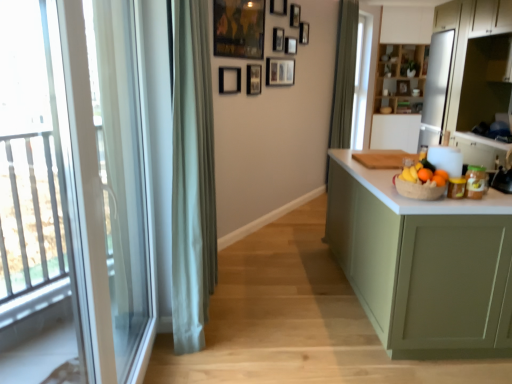
Question: Is wooden picture frame at upper center, which ranks as the 9th picture frame in left-to-right order, taller than orange matte at right, which appears as the 3th orange when viewed from the right?

Choices:
 (A) yes
 (B) no

Answer: (A)

Question: Does wooden picture frame at upper center, the second picture frame from the back, appear on the left side of orange matte at right, which appears as the 3th orange when viewed from the right?

Choices:
 (A) yes
 (B) no

Answer: (A)

Question: Does wooden picture frame at upper center, the second picture frame from the back, appear on the right side of orange matte at right, arranged as the first orange when viewed from the left?

Choices:
 (A) yes
 (B) no

Answer: (B)

Question: Is wooden picture frame at upper center, which ranks as the 9th picture frame in left-to-right order, in front of orange matte at right, arranged as the first orange when viewed from the left?

Choices:
 (A) no
 (B) yes

Answer: (A)

Question: Is wooden picture frame at upper center, the 9th picture frame in the front-to-back sequence, smaller than orange matte at right, arranged as the first orange when viewed from the left?

Choices:
 (A) no
 (B) yes

Answer: (A)

Question: Does wooden picture frame at upper center, the 9th picture frame in the front-to-back sequence, have a lesser width compared to orange matte at right, which appears as the 3th orange when viewed from the right?

Choices:
 (A) yes
 (B) no

Answer: (A)

Question: Is white matte cabinet at upper right, acting as the second cabinetry starting from the front, shorter than matte black picture frame at upper center, the 5th picture frame when ordered from right to left?

Choices:
 (A) no
 (B) yes

Answer: (A)

Question: Are white matte cabinet at upper right, which ranks as the 3th cabinetry in back-to-front order, and matte black picture frame at upper center, the 5th picture frame positioned from the front, located far from each other?

Choices:
 (A) no
 (B) yes

Answer: (B)

Question: Does white matte cabinet at upper right, acting as the second cabinetry starting from the front, appear on the right side of matte black picture frame at upper center, which appears as the 6th picture frame when viewed from the left?

Choices:
 (A) yes
 (B) no

Answer: (A)

Question: Can you see white matte cabinet at upper right, which ranks as the 3th cabinetry in back-to-front order, touching matte black picture frame at upper center, which appears as the sixth picture frame when viewed from the back?

Choices:
 (A) no
 (B) yes

Answer: (A)

Question: Can we say white matte cabinet at upper right, acting as the second cabinetry starting from the front, lies outside matte black picture frame at upper center, which appears as the sixth picture frame when viewed from the back?

Choices:
 (A) no
 (B) yes

Answer: (B)

Question: Is white matte cabinet at upper right, which is the 2th cabinetry from right to left, positioned before matte black picture frame at upper center, the 5th picture frame positioned from the front?

Choices:
 (A) no
 (B) yes

Answer: (B)

Question: Is white matte cabinet at upper right, acting as the second cabinetry starting from the front, surrounded by black matte picture frame at upper center, placed as the second picture frame when sorted from front to back?

Choices:
 (A) yes
 (B) no

Answer: (B)